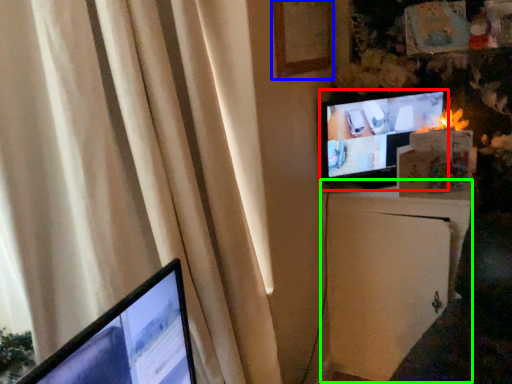
Question: Based on their relative distances, which object is farther from television (highlighted by a red box)? Choose from picture frame (highlighted by a blue box) and file cabinet (highlighted by a green box).

Choices:
 (A) picture frame
 (B) file cabinet

Answer: (A)